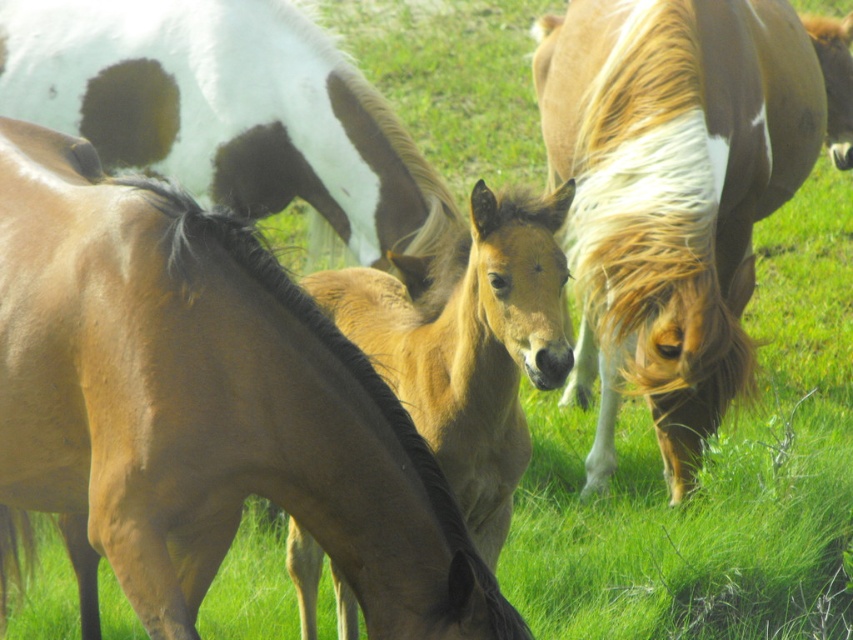
Is white glossy horse at upper left thinner than light brown glossy foal at center?

In fact, white glossy horse at upper left might be wider than light brown glossy foal at center.

How far apart are white glossy horse at upper left and light brown glossy foal at center?

white glossy horse at upper left and light brown glossy foal at center are 4.41 feet apart.

Is point (134, 122) positioned in front of point (421, 374)?

No, (134, 122) is behind (421, 374).

This screenshot has height=640, width=853. Identify the location of white glossy horse at upper left. (227, 112).

Is light brown glossy horse at center further to the viewer compared to white glossy horse at upper left?

No, it is not.

Is light brown glossy horse at center below white glossy horse at upper left?

Indeed, light brown glossy horse at center is positioned under white glossy horse at upper left.

I want to click on light brown glossy horse at center, so click(200, 408).

Does light brown glossy horse at center have a greater height compared to brown glossy horse at center?

No.

Who is positioned more to the left, light brown glossy horse at center or brown glossy horse at center?

From the viewer's perspective, light brown glossy horse at center appears more on the left side.

This screenshot has width=853, height=640. Describe the element at coordinates (200, 408) in the screenshot. I see `light brown glossy horse at center` at that location.

You are a GUI agent. You are given a task and a screenshot of the screen. Output one action in this format:
    pyautogui.click(x=<x>, y=<y>)
    Task: Click on the light brown glossy horse at center
    
    Given the screenshot: What is the action you would take?
    pyautogui.click(x=200, y=408)